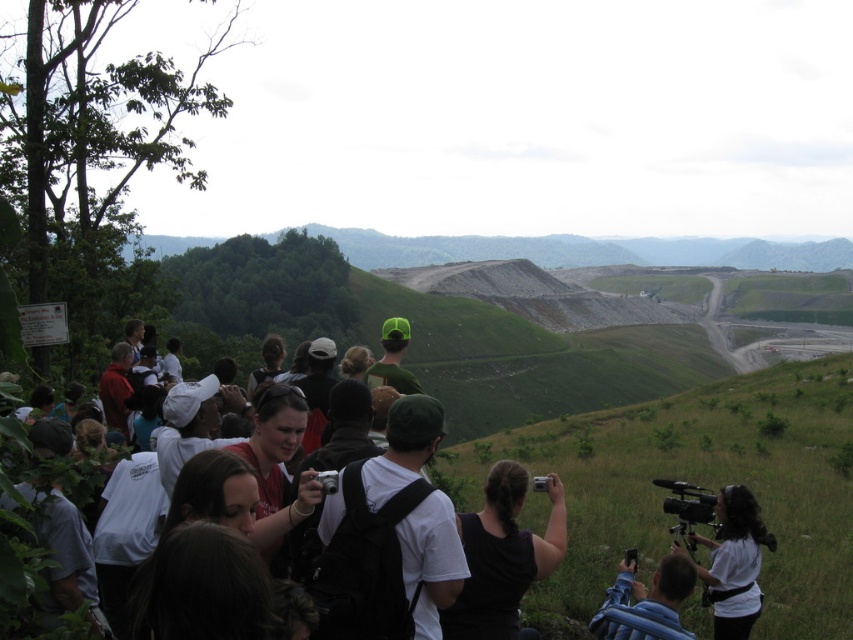
Based on the photo, does white matte backpack at center come in front of white matte camera at lower right?

Yes, white matte backpack at center is closer to the viewer.

Does white matte backpack at center have a greater width compared to white matte camera at lower right?

Yes.

This screenshot has width=853, height=640. What are the coordinates of `white matte backpack at center` in the screenshot? It's located at (386, 467).

Does white matte backpack at center come in front of blue fabric backpack at lower center?

No.

Is point (428, 456) positioned in front of point (688, 637)?

No, it is not.

Is point (379, 477) more distant than point (606, 632)?

Yes, point (379, 477) is behind point (606, 632).

Where is `white matte backpack at center`? This screenshot has width=853, height=640. white matte backpack at center is located at coordinates (386, 467).

Is black fabric camera at center to the left of blue fabric backpack at lower center from the viewer's perspective?

Indeed, black fabric camera at center is positioned on the left side of blue fabric backpack at lower center.

Can you confirm if black fabric camera at center is smaller than blue fabric backpack at lower center?

No.

This screenshot has width=853, height=640. I want to click on black fabric camera at center, so click(x=502, y=556).

In order to click on black fabric camera at center in this screenshot , I will do `click(502, 556)`.